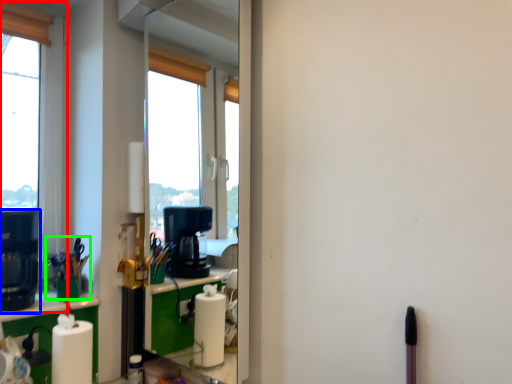
Question: Which object is the closest to the window (highlighted by a red box)? Choose among these: coffee machine (highlighted by a blue box) or stationery (highlighted by a green box).

Choices:
 (A) coffee machine
 (B) stationery

Answer: (A)